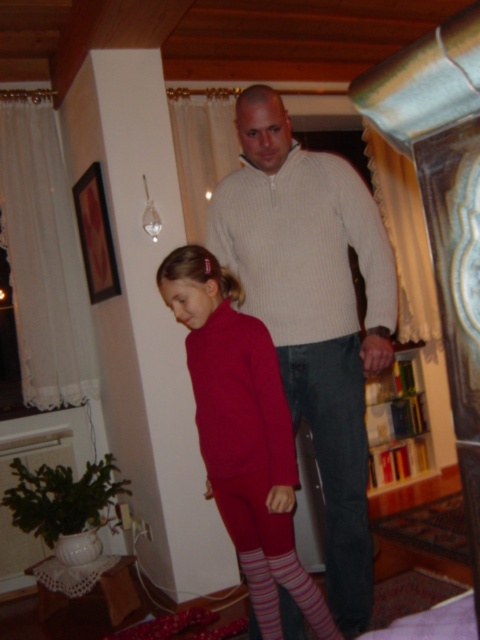
Question: Which point is farther to the camera?

Choices:
 (A) (301, 192)
 (B) (206, 346)

Answer: (A)

Question: Can you confirm if knitted beige sweater at center is positioned to the left of matte red sweater at center?

Choices:
 (A) yes
 (B) no

Answer: (B)

Question: Does matte red sweater at center have a smaller size compared to striped cotton sock at lower center?

Choices:
 (A) yes
 (B) no

Answer: (B)

Question: Considering the relative positions of knitted beige sweater at center and pink striped sock at lower center in the image provided, where is knitted beige sweater at center located with respect to pink striped sock at lower center?

Choices:
 (A) left
 (B) right

Answer: (B)

Question: Among these points, which one is nearest to the camera?

Choices:
 (A) (256, 593)
 (B) (243, 387)
 (C) (300, 595)
 (D) (343, 248)

Answer: (B)

Question: Which of these objects is positioned farthest from the striped cotton sock at lower center?

Choices:
 (A) matte red sweater at center
 (B) knitted beige sweater at center

Answer: (B)